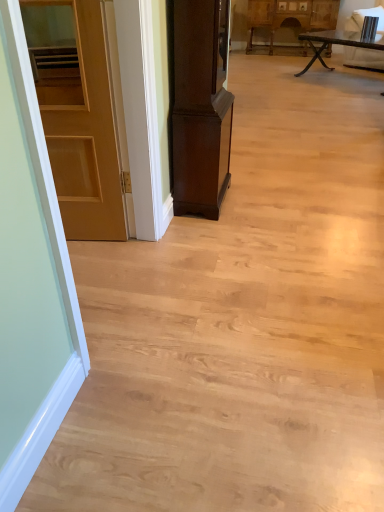
Question: From a real-world perspective, is matte wooden door at left above or below wooden carved cabinet at upper center, the 2th cabinetry in the bottom-to-top sequence?

Choices:
 (A) below
 (B) above

Answer: (B)

Question: Choose the correct answer: Is matte wooden door at left inside wooden carved cabinet at upper center, the 1th cabinetry when ordered from top to bottom, or outside it?

Choices:
 (A) inside
 (B) outside

Answer: (B)

Question: Which object is the farthest from the wooden carved cabinet at upper center, the 1th cabinetry positioned from the right?

Choices:
 (A) matte wooden door at left
 (B) dark wood cabinet at center, arranged as the first cabinetry when viewed from the front
 (C) wooden rustic table at upper right

Answer: (A)

Question: Estimate the real-world distances between objects in this image. Which object is closer to the wooden rustic table at upper right?

Choices:
 (A) matte wooden door at left
 (B) dark wood cabinet at center, the 2th cabinetry when ordered from right to left
 (C) wooden carved cabinet at upper center, which is the second cabinetry from front to back

Answer: (C)